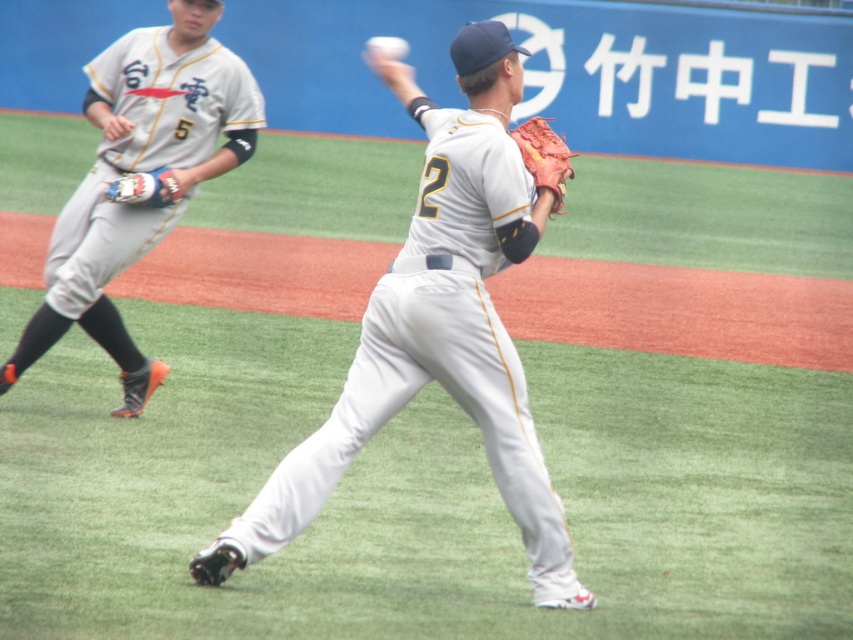
You are a baseball player standing at the center of the field. You see the white matte baseball glove at center and the leather textured glove at center. Which glove is closer to you?

The white matte baseball glove at center is 28.31 inches away from the leather textured glove at center, so the leather textured glove at center is closer to you.

You are a baseball player and you need to choose a glove to catch a high fly ball. Which glove, the white matte baseball glove at upper center or the leather textured glove at center, is better suited for catching the ball?

The white matte baseball glove at upper center is taller than the leather textured glove at center, so it would be better suited for catching a high fly ball because its taller design can reach higher positions.

You are a baseball coach observing the game. You notice the white matte baseball glove at upper center and the leather textured glove at center. Which glove is closer to the background?

The leather textured glove at center is behind the white matte baseball glove at upper center, so it is closer to the background.